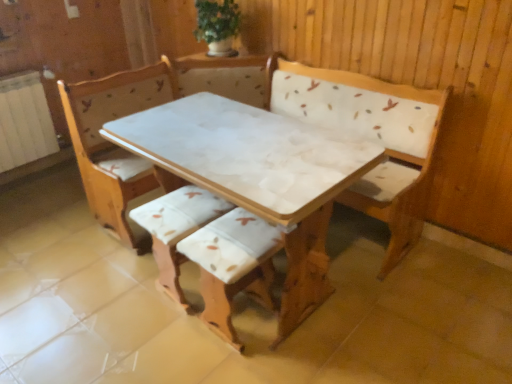
Locate an element on the screen. The image size is (512, 384). free location to the left of wooden armchair at center, which is the first armchair in right-to-left order is located at coordinates pyautogui.click(x=162, y=339).